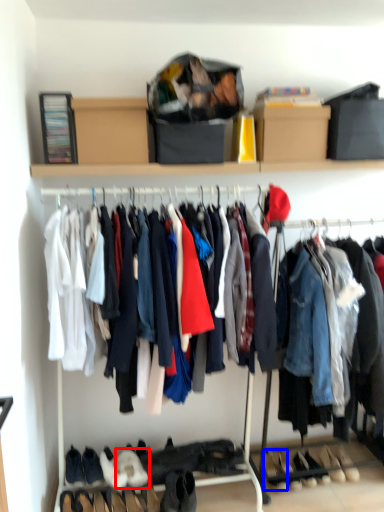
Question: Which object is closer to the camera taking this photo, footwear (highlighted by a red box) or shoe (highlighted by a blue box)?

Choices:
 (A) footwear
 (B) shoe

Answer: (A)